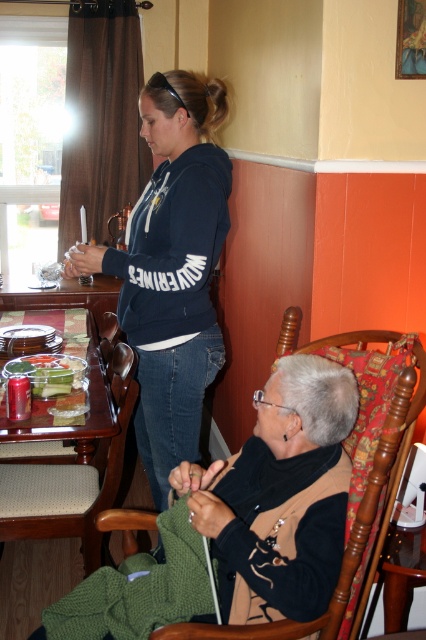
From the picture: Can you confirm if brown wood chair at lower left is positioned above clear glass tray at lower left?

Incorrect, brown wood chair at lower left is not positioned above clear glass tray at lower left.

Between point (100, 483) and point (94, 348), which one is positioned behind?

The point (94, 348) is more distant.

Find the location of a particular element. brown wood chair at lower left is located at coordinates (71, 481).

Between dark blue hoodie at center and green plastic container at left, which one appears on the left side from the viewer's perspective?

From the viewer's perspective, green plastic container at left appears more on the left side.

Does point (210, 152) come behind point (45, 387)?

No, it is not.

Image resolution: width=426 pixels, height=640 pixels. I want to click on dark blue hoodie at center, so click(x=172, y=268).

Looking at this image, between dark blue hoodie at center and clear glass tray at lower left, which one is positioned lower?

clear glass tray at lower left is below.

Is point (141, 401) positioned behind point (14, 314)?

No, it is not.

At what (x,y) coordinates should I click in order to perform the action: click on dark blue hoodie at center. Please return your answer as a coordinate pair (x, y). Image resolution: width=426 pixels, height=640 pixels. Looking at the image, I should click on (172, 268).